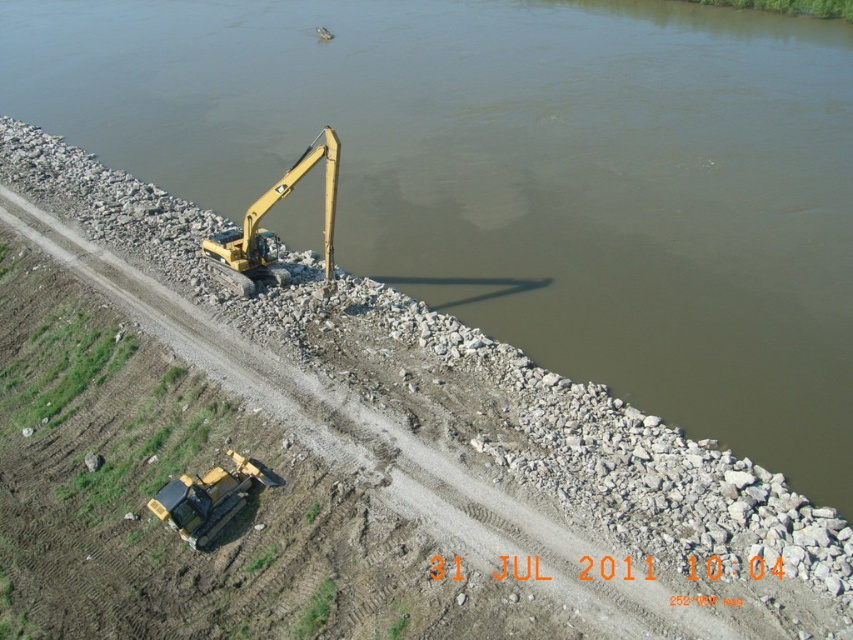
You are a construction worker who needs to transport materials across the river using a flatbed that can only carry items up to 3 meters wide. You have access to both the yellow metallic excavator at center and the yellow rubber tractor at lower left. Which machine should you choose to ensure it fits on the flatbed?

The yellow rubber tractor at lower left is narrower than the yellow metallic excavator at center. Since the flatbed can carry items up to 3 meters wide, the yellow rubber tractor at lower left is more likely to fit within the width limit.

You are a construction worker standing on the dirt path by the river. You need to move a heavy load from the yellow rubber tractor at lower left to the yellow metallic excavator at center. Which direction should you move the load to ensure it reaches the excavator?

The yellow metallic excavator at center is positioned on the left side of the yellow rubber tractor at lower left, so you should move the load to the left to reach the excavator.

You are a construction worker who needs to transport a heavy load of rocks from the riverbank to a nearby dump site. You have access to both the yellow metallic excavator at center and the yellow rubber tractor at lower left. Which vehicle would you choose and why?

You should choose the yellow metallic excavator at center because it is bigger than the yellow rubber tractor at lower left, making it more suitable for handling heavy loads.